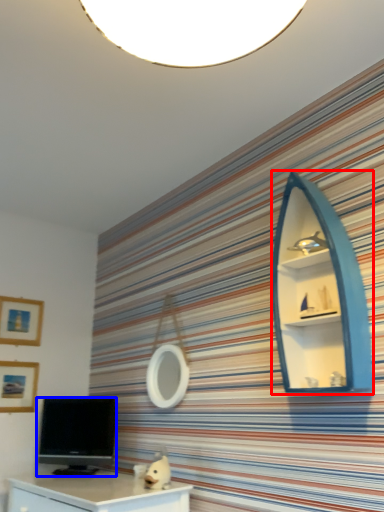
Question: Which object appears closest to the camera in this image, shelf (highlighted by a red box) or television (highlighted by a blue box)?

Choices:
 (A) shelf
 (B) television

Answer: (A)